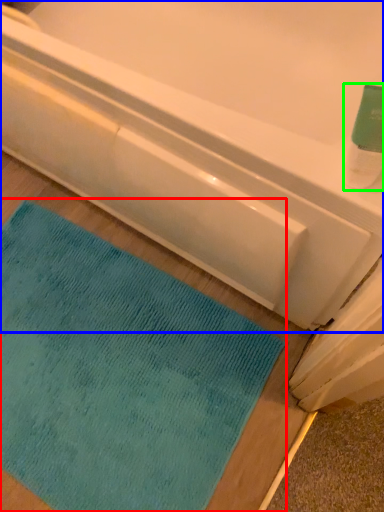
Question: Estimate the real-world distances between objects in this image. Which object is farther from mat (highlighted by a red box), bathtub (highlighted by a blue box) or cleaning product (highlighted by a green box)?

Choices:
 (A) bathtub
 (B) cleaning product

Answer: (B)